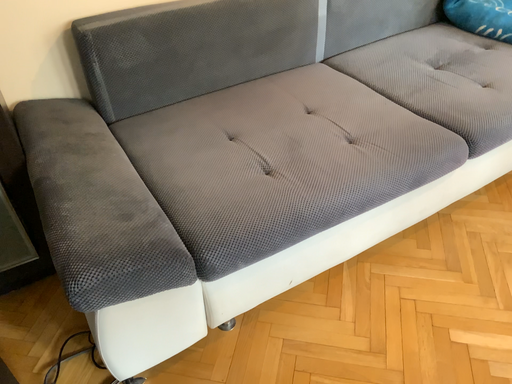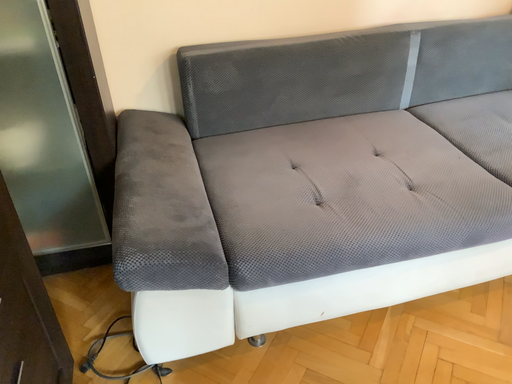
Question: Which way did the camera rotate in the video?

Choices:
 (A) rotated right
 (B) rotated left

Answer: (B)